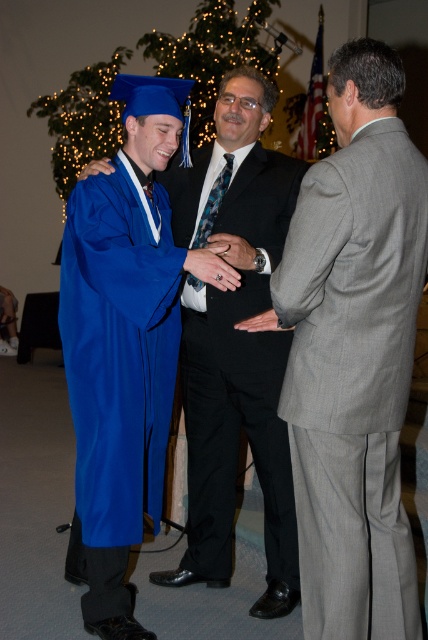
You are a photographer at the graduation ceremony. You need to arrange the participants so that the shorter person stands in front. Which participant should be placed in front between the gray textured suit at right and the matte black suit at center?

The gray textured suit at right should be placed in front because it is shorter than the matte black suit at center.

You are standing in the graduation hall and see the matte black suit at center and the blue matte graduation gown at left. Which one is closer to you?

The matte black suit at center is closer to you because it is positioned over the blue matte graduation gown at left, indicating it is in front.

You are a photographer at the graduation ceremony. You need to capture a photo that includes both the gray textured suit at right and the blue matte graduation gown at left. Based on their positions, which one should be placed on the right side of the photo to ensure both are in frame?

The gray textured suit at right is already positioned to the right of the blue matte graduation gown at left, so placing the gray textured suit at right on the right side of the photo will ensure both are in frame.